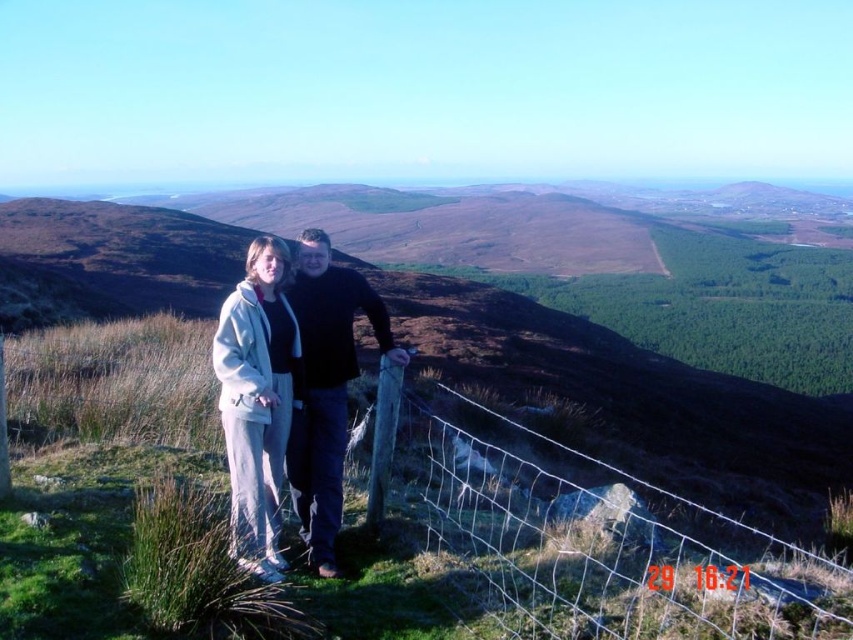
From the picture: Which is above, wire mesh fence at center or white fleece jacket at center?

white fleece jacket at center is above.

Is point (556, 572) in front of point (254, 308)?

Yes, it is in front of point (254, 308).

Where is `wire mesh fence at center`? wire mesh fence at center is located at coordinates (590, 536).

Is wire mesh fence at center to the left of black matte jacket at center from the viewer's perspective?

No, wire mesh fence at center is not to the left of black matte jacket at center.

Can you confirm if wire mesh fence at center is thinner than black matte jacket at center?

No, wire mesh fence at center is not thinner than black matte jacket at center.

Who is more distant from viewer, (666, 580) or (317, 326)?

The point (317, 326) is more distant.

At what (x,y) coordinates should I click in order to perform the action: click on wire mesh fence at center. Please return your answer as a coordinate pair (x, y). Looking at the image, I should click on (590, 536).

Between white fleece jacket at center and black matte jacket at center, which one has less height?

Standing shorter between the two is white fleece jacket at center.

Is point (234, 380) behind point (328, 304)?

That is False.

You are a GUI agent. You are given a task and a screenshot of the screen. Output one action in this format:
    pyautogui.click(x=<x>, y=<y>)
    Task: Click on the white fleece jacket at center
    This screenshot has width=853, height=640.
    Given the screenshot: What is the action you would take?
    pyautogui.click(x=256, y=401)